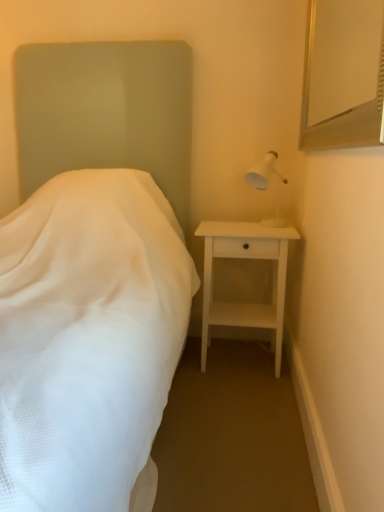
Question: Is white fabric bed at left to the left or to the right of white plastic lamp at upper right in the image?

Choices:
 (A) left
 (B) right

Answer: (A)

Question: Is white fabric bed at left wider or thinner than white plastic lamp at upper right?

Choices:
 (A) thin
 (B) wide

Answer: (B)

Question: Estimate the real-world distances between objects in this image. Which object is closer to the white fabric bed at left?

Choices:
 (A) silver metallic mirror at upper right
 (B) white matte nightstand at right
 (C) white plastic lamp at upper right

Answer: (B)

Question: Considering the real-world distances, which object is farthest from the white matte nightstand at right?

Choices:
 (A) white fabric bed at left
 (B) white plastic lamp at upper right
 (C) silver metallic mirror at upper right

Answer: (C)